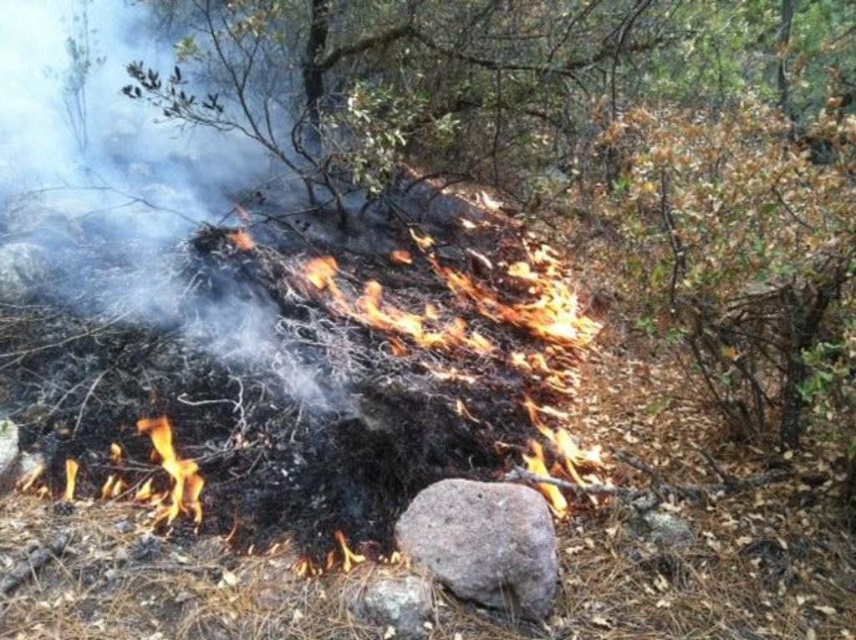
Is charred wood pile at center positioned before gray rough rock at center?

No.

Who is higher up, charred wood pile at center or gray rough rock at center?

charred wood pile at center is higher up.

What do you see at coordinates (330, 369) in the screenshot? I see `charred wood pile at center` at bounding box center [330, 369].

Identify the location of charred wood pile at center. (330, 369).